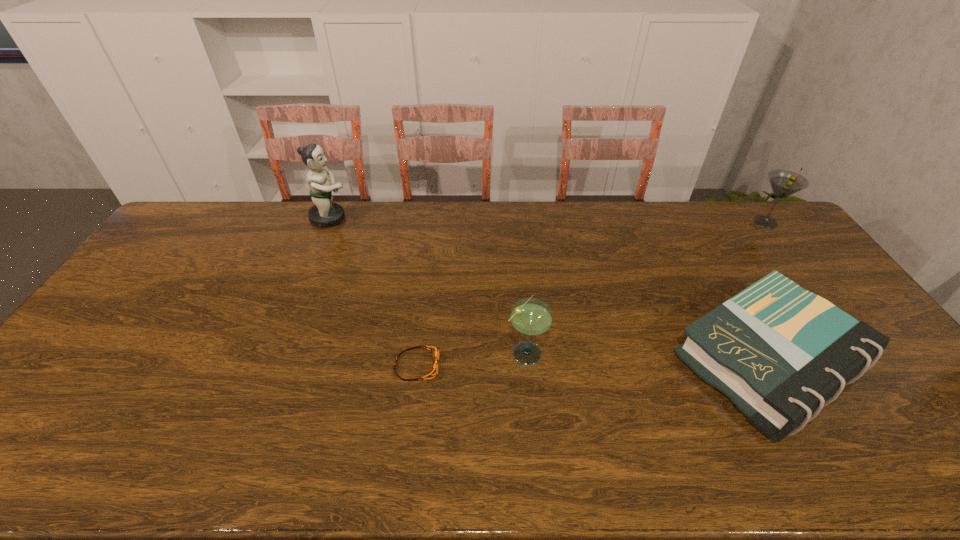
The width and height of the screenshot is (960, 540). Find the location of `free space that satisfies the following two spatial constraints: 1. on the back side of the second tallest object; 2. on the front-facing side of the leftmost object`. free space that satisfies the following two spatial constraints: 1. on the back side of the second tallest object; 2. on the front-facing side of the leftmost object is located at coordinates [762, 218].

Where is `vacant area that satisfies the following two spatial constraints: 1. on the back side of the paperback book; 2. on the left side of the taller martini`? This screenshot has width=960, height=540. vacant area that satisfies the following two spatial constraints: 1. on the back side of the paperback book; 2. on the left side of the taller martini is located at coordinates (690, 222).

I want to click on vacant space that satisfies the following two spatial constraints: 1. on the front-facing side of the tallest object; 2. on the left side of the nearer martini, so click(276, 351).

Locate an element on the screen. free region that satisfies the following two spatial constraints: 1. on the back side of the farther martini; 2. on the left side of the left martini is located at coordinates (515, 222).